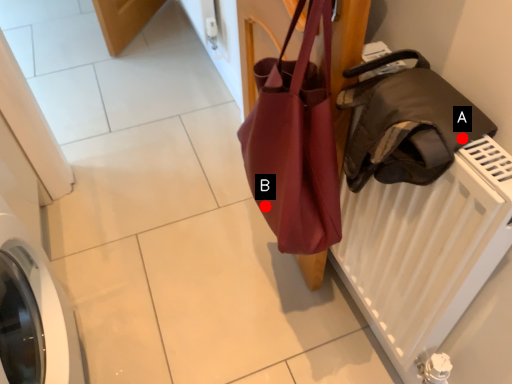
Question: Two points are circled on the image, labeled by A and B beside each circle. Among these points, which one is farthest from the camera?

Choices:
 (A) A is further
 (B) B is further

Answer: (B)